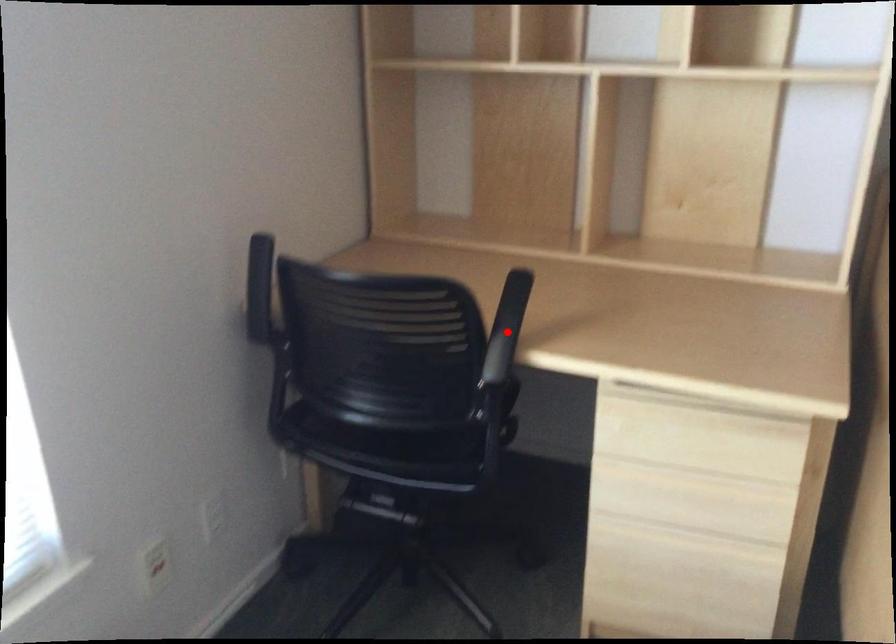
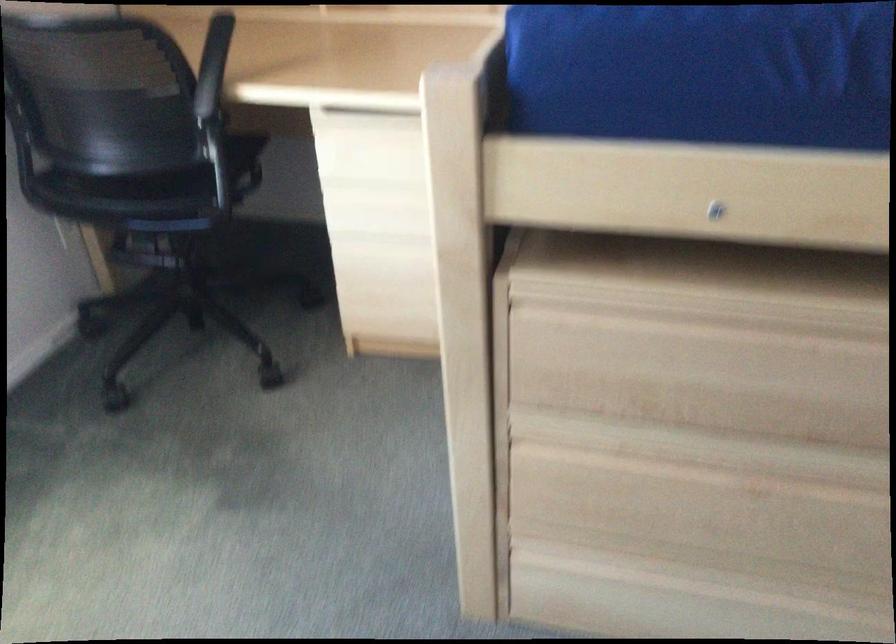
Where in the second image is the point corresponding to the highlighted location from the first image?

(212, 66)